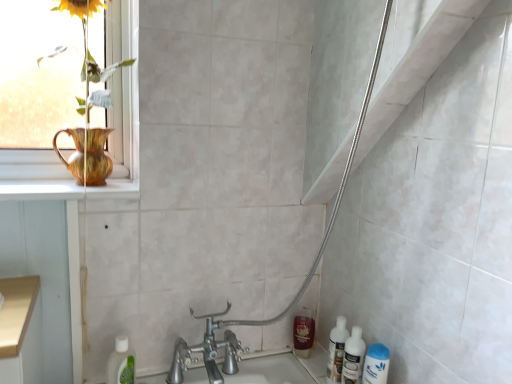
Question: From the image's perspective, is shiny brown bottle at lower right, the 1th mouthwash from the back, above or below white glossy mouthwash at lower right, which is counted as the 1th mouthwash, starting from the front?

Choices:
 (A) above
 (B) below

Answer: (A)

Question: Based on their sizes in the image, would you say shiny brown bottle at lower right, the 1th mouthwash from the back, is bigger or smaller than white glossy mouthwash at lower right, which is the 1th mouthwash from right to left?

Choices:
 (A) big
 (B) small

Answer: (B)

Question: Based on their relative distances, which object is farther from the clear plastic bottle at lower left, positioned as the second cleaning product in right-to-left order?

Choices:
 (A) white glossy mouthwash at lower right, which is the 1th mouthwash from right to left
 (B) matte gold vase at upper left
 (C) shiny brown bottle at lower right, the second mouthwash when ordered from front to back
 (D) translucent plastic bottles at lower right
 (E) white glossy bottles at lower right, marked as the first cleaning product in a right-to-left arrangement

Answer: (A)

Question: Which object is positioned farthest from the translucent plastic bottles at lower right?

Choices:
 (A) white glossy mouthwash at lower right, which is counted as the 1th mouthwash, starting from the front
 (B) white glossy bottles at lower right, marked as the first cleaning product in a right-to-left arrangement
 (C) shiny brown bottle at lower right, the 1th mouthwash from the back
 (D) clear plastic bottle at lower left, positioned as the second cleaning product in right-to-left order
 (E) matte gold vase at upper left

Answer: (E)